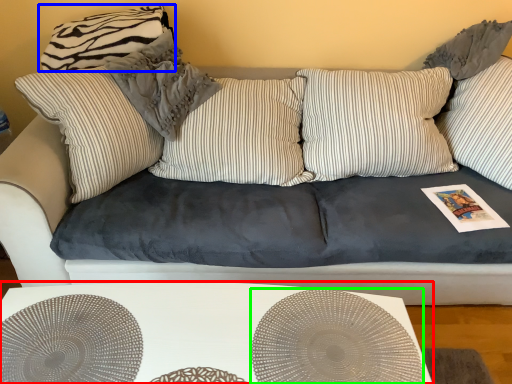
Question: Which is farther away from table (highlighted by a red box)? pillow (highlighted by a blue box) or circle (highlighted by a green box)?

Choices:
 (A) pillow
 (B) circle

Answer: (A)